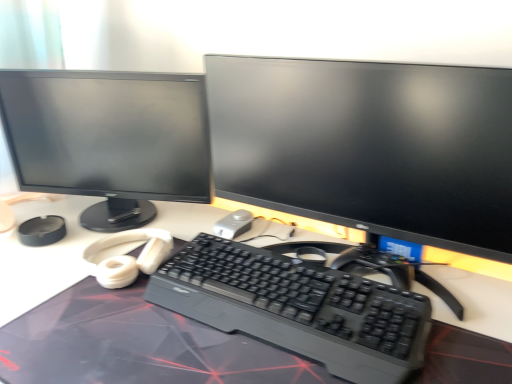
Question: Could you tell me if matte black monitor at left, arranged as the first computer monitor when viewed from the left, is facing satin silver mouse at center?

Choices:
 (A) no
 (B) yes

Answer: (A)

Question: From the image's perspective, is matte black monitor at left, arranged as the first computer monitor when viewed from the left, below satin silver mouse at center?

Choices:
 (A) yes
 (B) no

Answer: (B)

Question: Considering the relative sizes of matte black monitor at left, which is counted as the second computer monitor, starting from the right, and satin silver mouse at center in the image provided, is matte black monitor at left, which is counted as the second computer monitor, starting from the right, taller than satin silver mouse at center?

Choices:
 (A) yes
 (B) no

Answer: (A)

Question: Is matte black monitor at left, which is counted as the second computer monitor, starting from the right, not inside satin silver mouse at center?

Choices:
 (A) yes
 (B) no

Answer: (A)

Question: Does matte black monitor at left, which is counted as the second computer monitor, starting from the right, lie behind satin silver mouse at center?

Choices:
 (A) yes
 (B) no

Answer: (B)

Question: Is point (173, 283) closer or farther from the camera than point (152, 345)?

Choices:
 (A) closer
 (B) farther

Answer: (B)

Question: Based on their sizes in the image, would you say black plastic keyboard at center is bigger or smaller than black matte desk at center?

Choices:
 (A) small
 (B) big

Answer: (A)

Question: Looking at their shapes, would you say black plastic keyboard at center is wider or thinner than black matte desk at center?

Choices:
 (A) thin
 (B) wide

Answer: (A)

Question: From the image's perspective, relative to black matte desk at center, is black plastic keyboard at center above or below?

Choices:
 (A) above
 (B) below

Answer: (A)

Question: Is matte black monitor at center, which is the 1th computer monitor in right-to-left order, bigger or smaller than black matte desk at center?

Choices:
 (A) small
 (B) big

Answer: (A)

Question: Would you say matte black monitor at center, which is the 1th computer monitor in right-to-left order, is inside or outside black matte desk at center?

Choices:
 (A) inside
 (B) outside

Answer: (B)

Question: From the image's perspective, is matte black monitor at center, which is the 1th computer monitor in right-to-left order, positioned above or below black matte desk at center?

Choices:
 (A) above
 (B) below

Answer: (A)

Question: From their relative heights in the image, would you say matte black monitor at center, which is the 1th computer monitor in right-to-left order, is taller or shorter than black matte desk at center?

Choices:
 (A) tall
 (B) short

Answer: (B)

Question: In terms of size, does black plastic keyboard at center appear bigger or smaller than satin silver mouse at center?

Choices:
 (A) small
 (B) big

Answer: (B)

Question: Visually, is black plastic keyboard at center positioned to the left or to the right of satin silver mouse at center?

Choices:
 (A) left
 (B) right

Answer: (B)